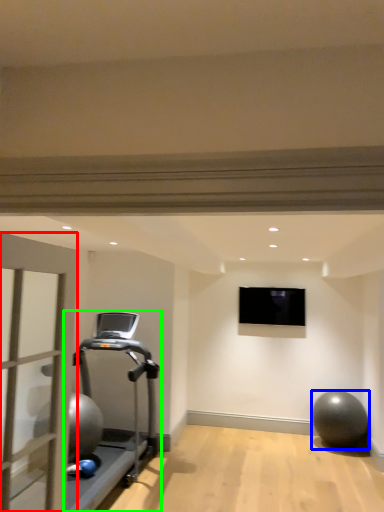
Question: Based on their relative distances, which object is farther from garage door (highlighted by a red box)? Choose from ball (highlighted by a blue box) and treadmill (highlighted by a green box).

Choices:
 (A) ball
 (B) treadmill

Answer: (A)